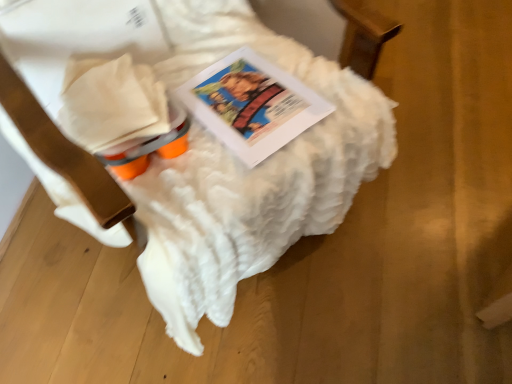
Question: From their relative heights in the image, would you say matte paper book at center is taller or shorter than white fluffy blanket at upper center?

Choices:
 (A) short
 (B) tall

Answer: (A)

Question: Is matte paper book at center in front of or behind white fluffy blanket at upper center in the image?

Choices:
 (A) behind
 (B) front

Answer: (A)

Question: From a real-world perspective, is matte paper book at center above or below white fluffy blanket at upper center?

Choices:
 (A) above
 (B) below

Answer: (B)

Question: Do you think white fluffy blanket at upper center is within matte paper book at center, or outside of it?

Choices:
 (A) outside
 (B) inside

Answer: (A)

Question: Considering the positions of point (321, 208) and point (254, 97), is point (321, 208) closer or farther from the camera than point (254, 97)?

Choices:
 (A) closer
 (B) farther

Answer: (B)

Question: From the image's perspective, is white fluffy blanket at upper center above or below matte paper book at center?

Choices:
 (A) below
 (B) above

Answer: (B)

Question: Considering the positions of white fluffy blanket at upper center and matte paper book at center in the image, is white fluffy blanket at upper center wider or thinner than matte paper book at center?

Choices:
 (A) thin
 (B) wide

Answer: (B)